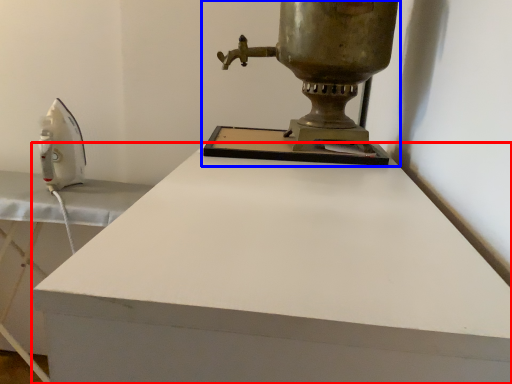
Question: Which object appears closest to the camera in this image, desk (highlighted by a red box) or sewing machine (highlighted by a blue box)?

Choices:
 (A) desk
 (B) sewing machine

Answer: (A)